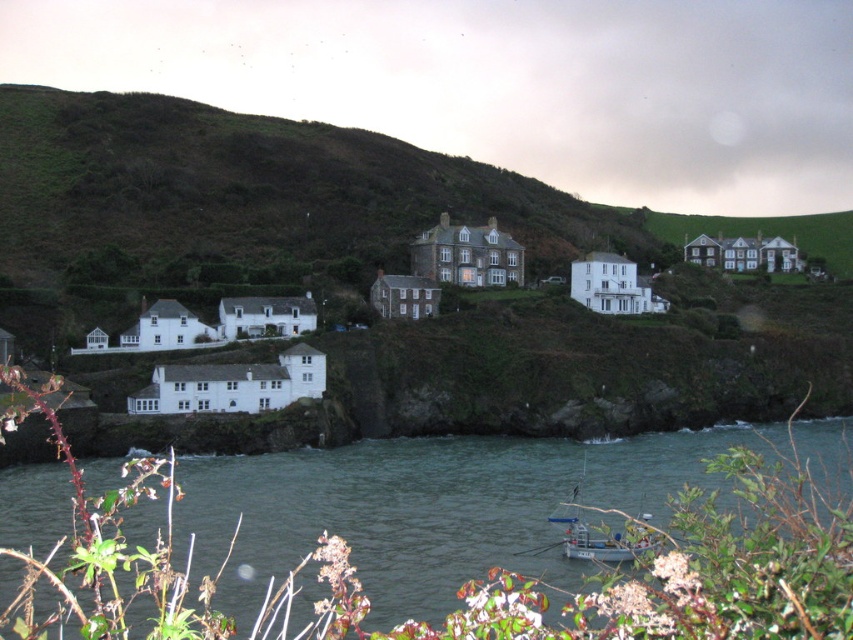
You are a tourist standing at the edge of the cliff in the coastal village. You see the white matte house at center and the metallic gray boat at lower center. Which object is closer to your right side?

The white matte house at center is positioned on the right side of the metallic gray boat at lower center, so when standing at the cliff edge facing the scene, the white matte house at center would be to your right.

You are planning to build a new dock for the fishing boat. The dock needs to be as wide as the white matte house at center. Can the dock fit in the space occupied by the clear water at lower center without overlapping the house? Explain your reasoning.

The clear water at lower center is wider than the white matte house at center. Since the dock needs to be as wide as the house, the space occupied by the clear water is sufficient to accommodate the dock without overlapping the house.